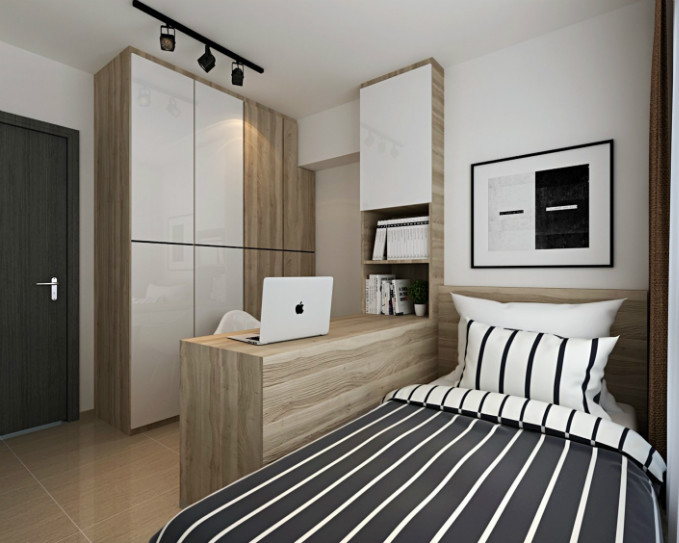
At what (x,y) coordinates should I click in order to perform the action: click on door handle. Please return your answer as a coordinate pair (x, y). Looking at the image, I should click on (55, 281).